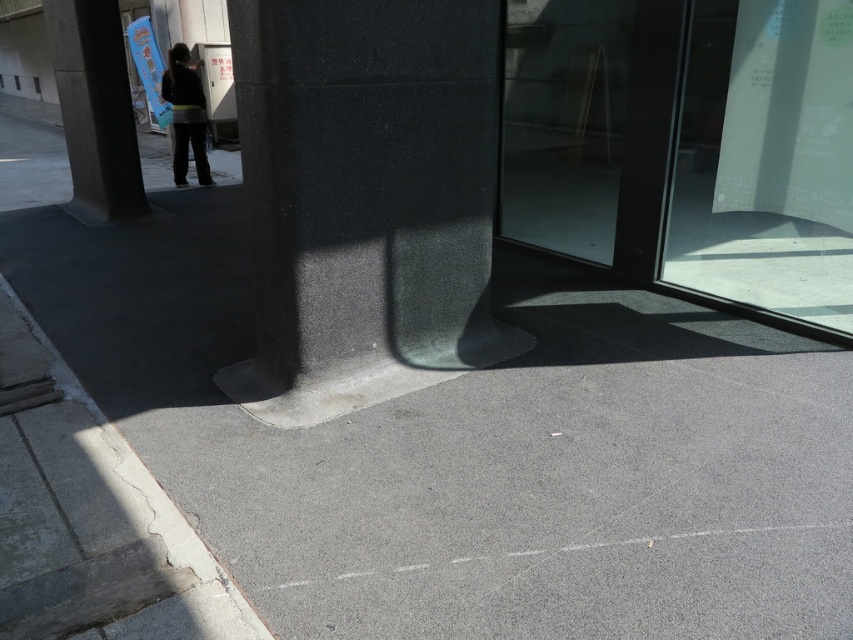
Does point (106, 147) come behind point (177, 122)?

That is False.

Can you confirm if matte gray pillar at upper left is positioned below dark gray pants at upper left?

Indeed, matte gray pillar at upper left is positioned under dark gray pants at upper left.

What do you see at coordinates (96, 109) in the screenshot?
I see `matte gray pillar at upper left` at bounding box center [96, 109].

Identify the location of matte gray pillar at upper left. The width and height of the screenshot is (853, 640). (96, 109).

Is point (198, 595) less distant than point (165, 83)?

That is True.

Between point (173, 554) and point (175, 168), which one is positioned behind?

The point (175, 168) is more distant.

Identify the location of gray concrete curb at lower left. (148, 522).

Which is more to the left, black granite pillar at center or gray concrete curb at lower left?

gray concrete curb at lower left

Does point (468, 285) come closer to viewer compared to point (59, 385)?

No, (468, 285) is further to viewer.

Consider the image. Measure the distance between black granite pillar at center and camera.

2.78 meters

Find the location of a particular element. The image size is (853, 640). black granite pillar at center is located at coordinates (367, 188).